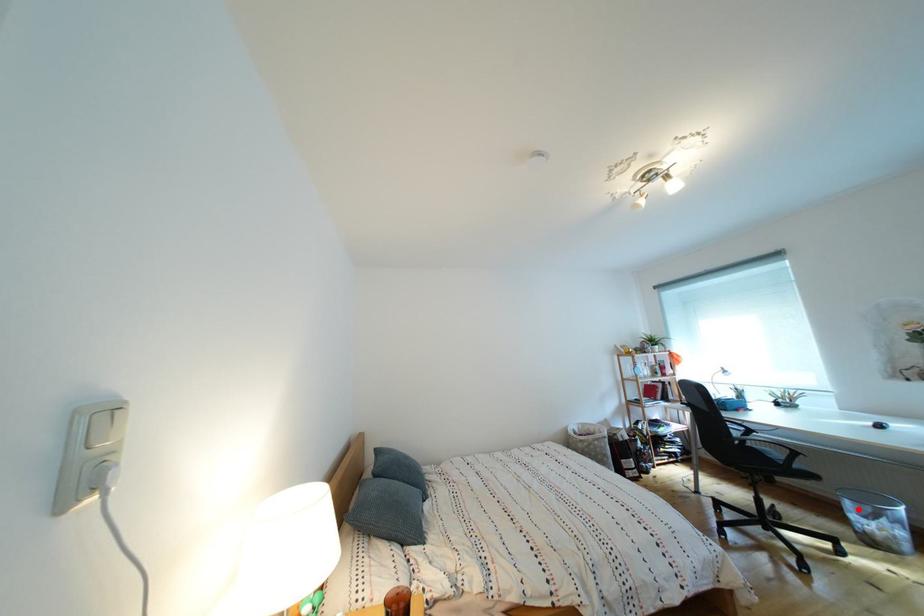
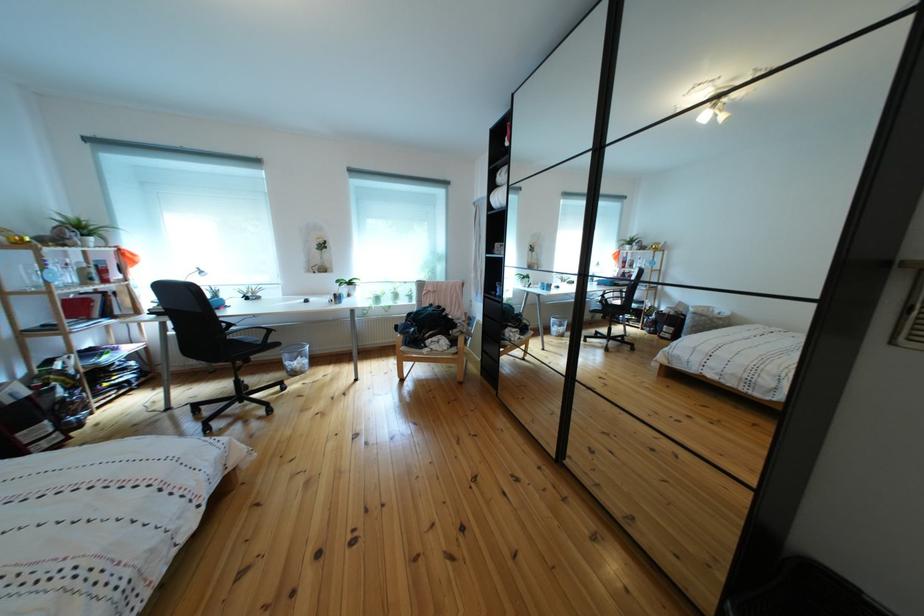
Question: I am providing you with two images of the same scene from different viewpoints. In image1, a red point is highlighted. Considering the same 3D point in image2, which of the following is correct?

Choices:
 (A) It is closer
 (B) It is farther

Answer: (B)